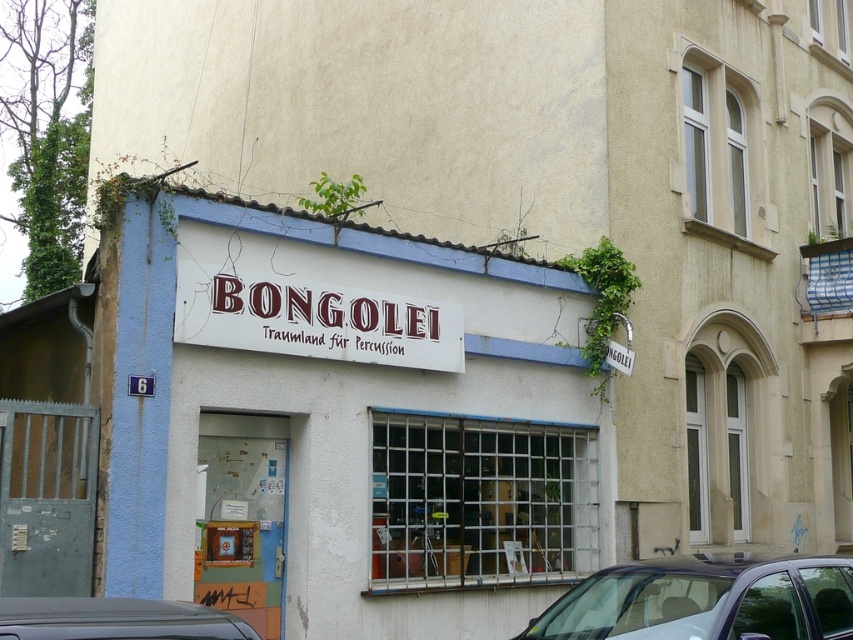
Who is more forward, (483, 499) or (267, 294)?

Point (267, 294)

Is white matte signboard at center thinner than matte red sign at center?

Incorrect, white matte signboard at center's width is not less than matte red sign at center's.

Between point (289, 209) and point (190, 339), which one is positioned behind?

The point (289, 209) is behind.

Locate an element on the screen. white matte signboard at center is located at coordinates (335, 420).

Who is taller, white matte signboard at center or metallic gray car at lower left?

white matte signboard at center

Can you confirm if white matte signboard at center is shorter than metallic gray car at lower left?

Incorrect, white matte signboard at center's height does not fall short of metallic gray car at lower left's.

Between point (341, 316) and point (190, 605), which one is positioned behind?

Positioned behind is point (341, 316).

Find the location of a particular element. white matte signboard at center is located at coordinates (335, 420).

Based on the photo, does white matte signboard at center have a smaller size compared to metallic silver car at lower right?

Actually, white matte signboard at center might be larger than metallic silver car at lower right.

In the scene shown: Who is taller, white matte signboard at center or metallic silver car at lower right?

white matte signboard at center is taller.

Locate an element on the screen. Image resolution: width=853 pixels, height=640 pixels. white matte signboard at center is located at coordinates (335, 420).

I want to click on white matte signboard at center, so pyautogui.click(x=335, y=420).